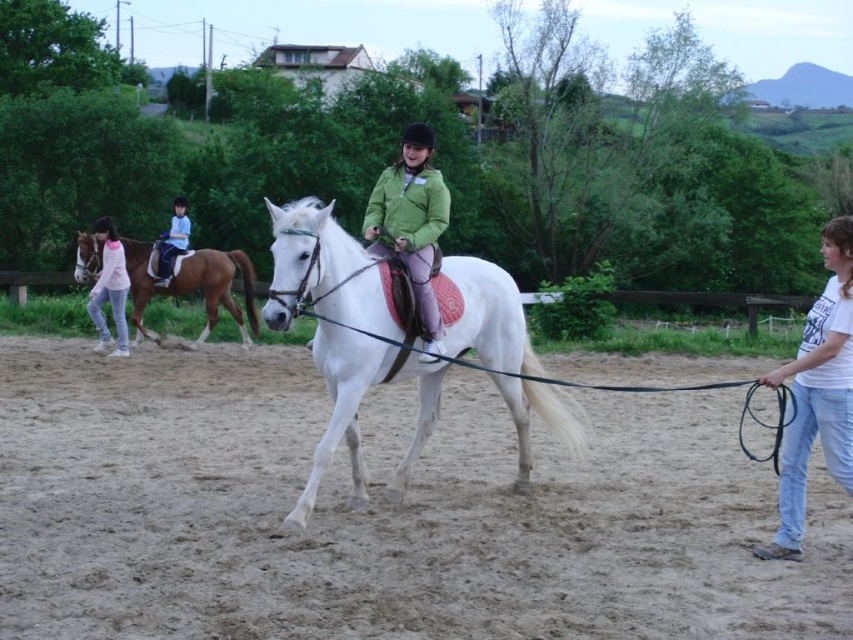
You are a photographer planning to take a photo of the sandy dirt field at center and the brown glossy horse at left. Which object should you focus on first if you want to capture both in the frame without moving the camera?

The sandy dirt field at center is bigger than the brown glossy horse at left, so you should focus on the sandy dirt field at center first to ensure it fills the frame appropriately before adjusting for the smaller horse.